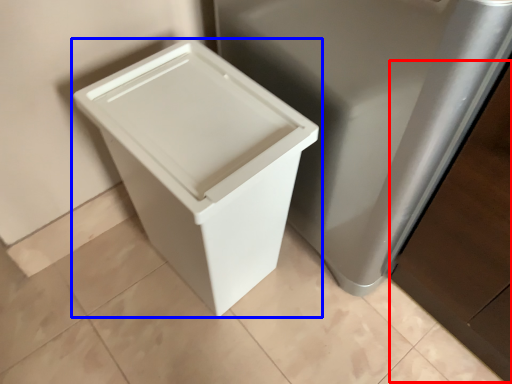
Question: Among these objects, which one is farthest to the camera, cabinetry (highlighted by a red box) or waste container (highlighted by a blue box)?

Choices:
 (A) cabinetry
 (B) waste container

Answer: (B)